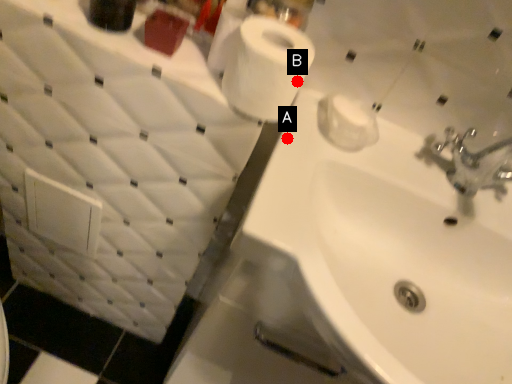
Question: Two points are circled on the image, labeled by A and B beside each circle. Which point appears farthest from the camera in this image?

Choices:
 (A) A is further
 (B) B is further

Answer: (A)